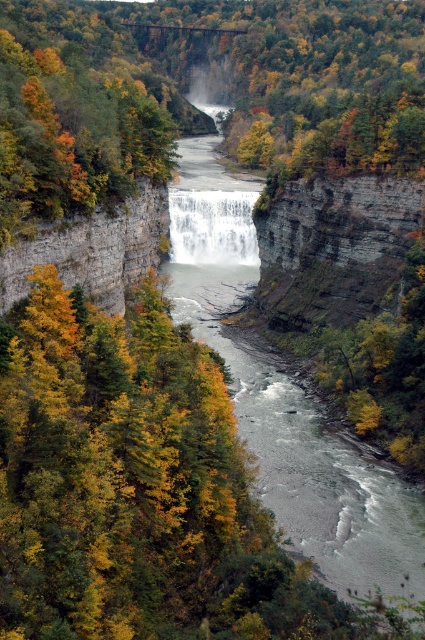
You are a hiker standing at the edge of the gray smooth river at center and looking towards the rustic stone cliff at left. Which object is closer to you?

The gray smooth river at center is closer to you because it is in front of the rustic stone cliff at left, meaning the cliff is further away.

You are a hiker standing at the edge of the cliff overlooking the waterfall and river. You notice autumn leaves at center and white textured water at center. Which object is taller from your viewpoint?

The autumn leaves at center are taller than the white textured water at center.